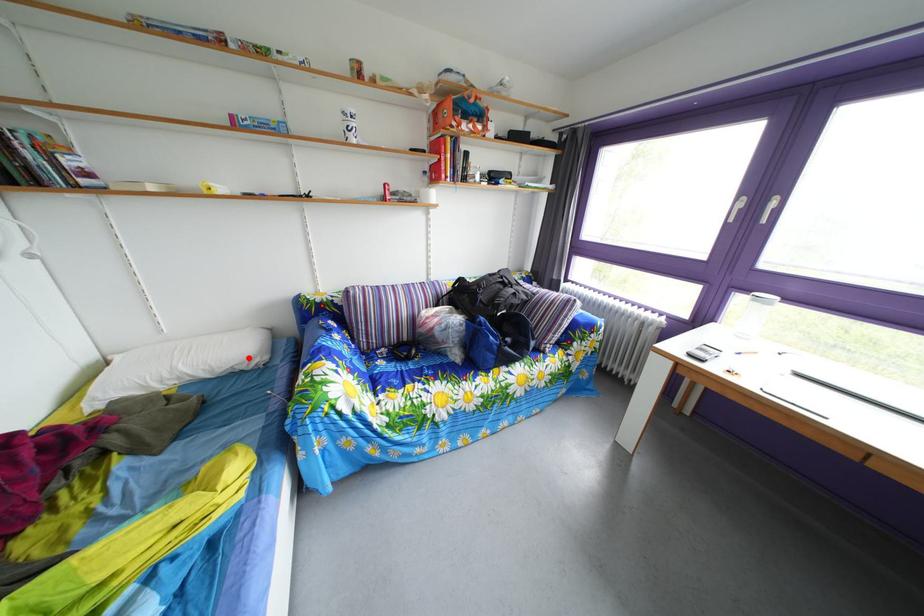
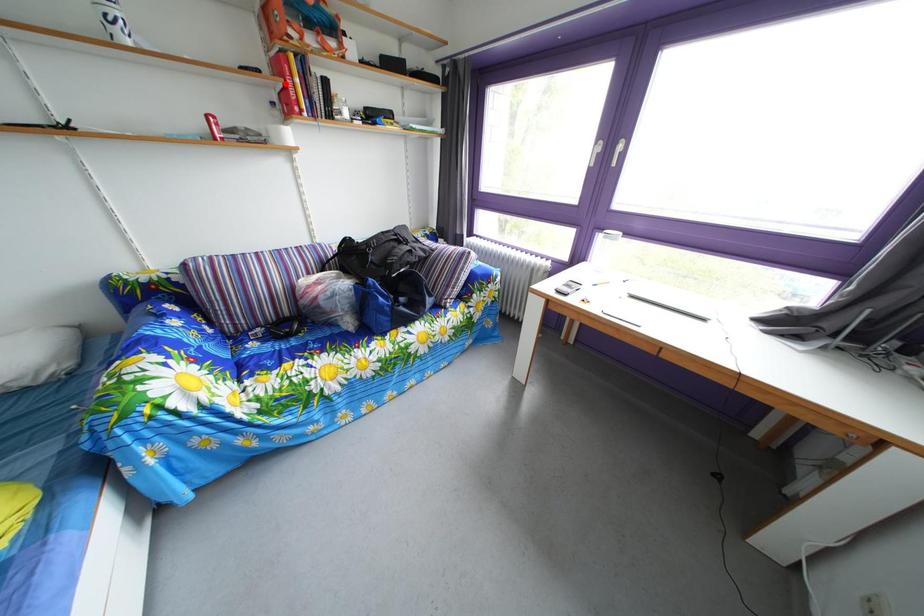
I am providing you with two images of the same scene from different viewpoints. A red point is marked on the first image and another point is marked on the second image. Do the highlighted points in image1 and image2 indicate the same real-world spot?

No